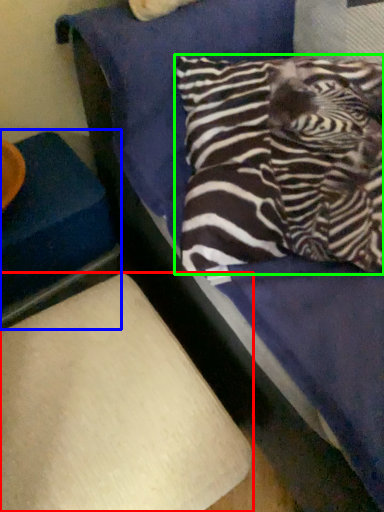
Question: Which object is the closest to the furniture (highlighted by a red box)? Choose among these: furniture (highlighted by a blue box) or pillow (highlighted by a green box).

Choices:
 (A) furniture
 (B) pillow

Answer: (A)